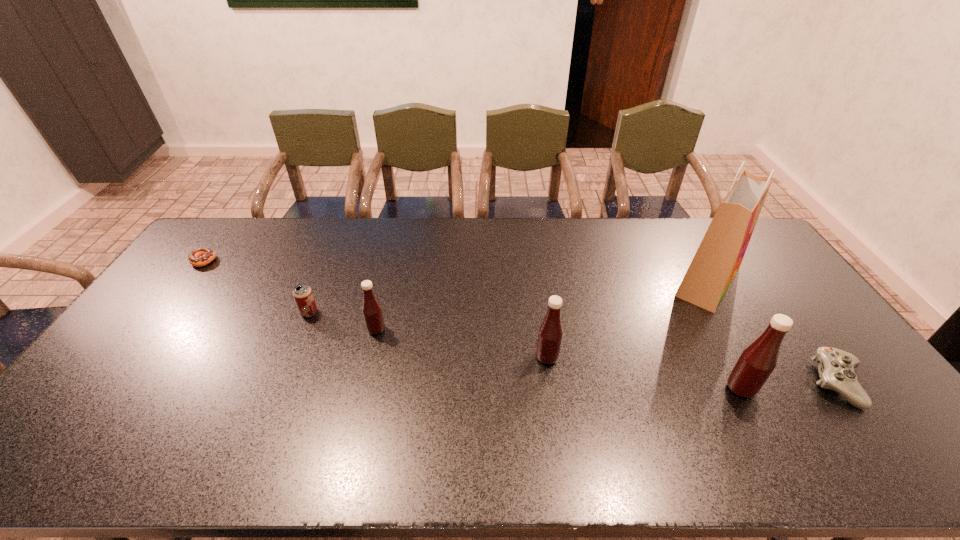
Select which object is the third closest to the doughnut. Please provide its 2D coordinates. Your answer should be formatted as a tuple, i.e. [(x, y)], where the tuple contains the x and y coordinates of a point satisfying the conditions above.

[(550, 334)]

Identify which object is the third nearest to the doughnut. Please provide its 2D coordinates. Your answer should be formatted as a tuple, i.e. [(x, y)], where the tuple contains the x and y coordinates of a point satisfying the conditions above.

[(550, 334)]

Identify the location of Tabasco sauce that is the second closest to the sixth object from right to left. (550, 334).

Locate an element on the screen. This screenshot has width=960, height=540. Tabasco sauce identified as the closest to the shopping bag is located at coordinates pyautogui.click(x=756, y=363).

At what (x,y) coordinates should I click in order to perform the action: click on free point that satisfies the following two spatial constraints: 1. on the back side of the leftmost Tabasco sauce; 2. on the left side of the tallest object. Please return your answer as a coordinate pair (x, y). The height and width of the screenshot is (540, 960). Looking at the image, I should click on (388, 281).